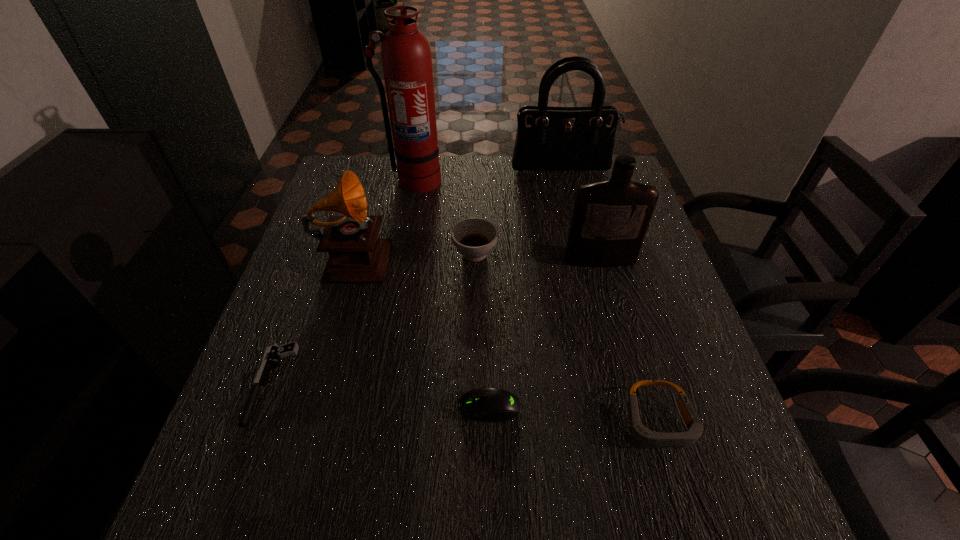
Image resolution: width=960 pixels, height=540 pixels. I want to click on free spot between the sixth tallest object and the handbag, so click(611, 295).

Where is `vacant space that is in between the phonograph record and the soup bowl`? This screenshot has height=540, width=960. vacant space that is in between the phonograph record and the soup bowl is located at coordinates (415, 253).

This screenshot has height=540, width=960. What are the coordinates of `free point between the fire extinguisher and the liquor` in the screenshot? It's located at (507, 220).

The width and height of the screenshot is (960, 540). I want to click on free spot between the soup bowl and the computer mouse, so click(482, 330).

Identify the location of unoccupied position between the third shortest object and the fire extinguisher. Image resolution: width=960 pixels, height=540 pixels. (536, 301).

Identify the location of unoccupied position between the phonograph record and the computer mouse. This screenshot has width=960, height=540. (421, 330).

The height and width of the screenshot is (540, 960). I want to click on free spot between the second shortest object and the shortest object, so 380,395.

This screenshot has width=960, height=540. In order to click on free space that is in between the liquor and the soup bowl in this screenshot , I will do `click(538, 256)`.

In order to click on free space between the pistol and the seventh tallest object in this screenshot , I will do `click(380, 395)`.

This screenshot has height=540, width=960. I want to click on object that stands as the second closest to the handbag, so click(x=474, y=238).